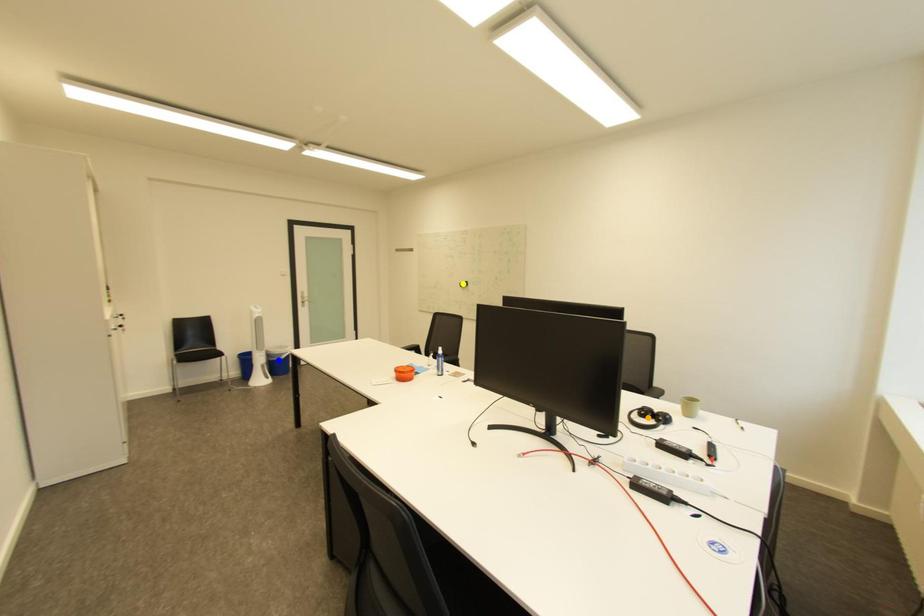
Order these from nearest to farthest:
yellow point | blue point | orange point

orange point
blue point
yellow point